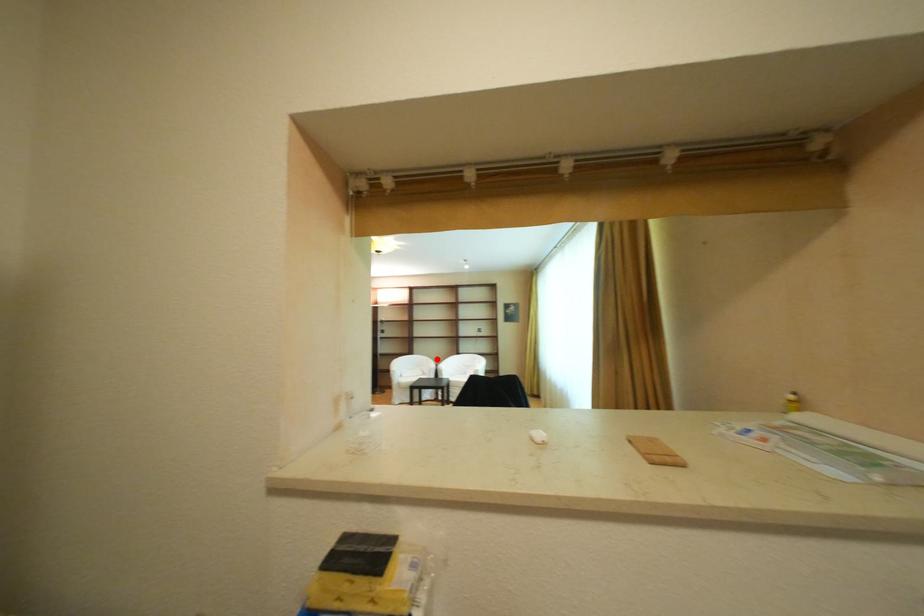
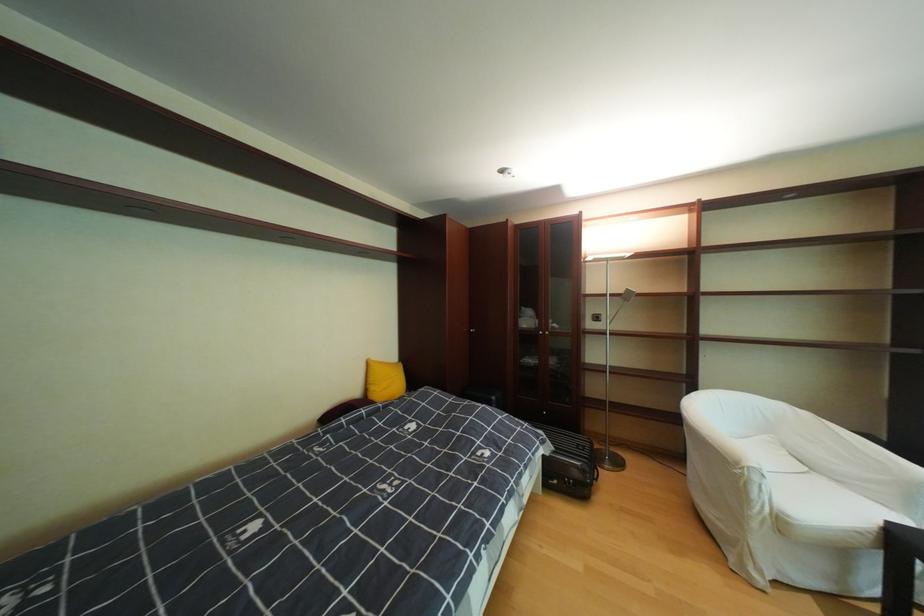
Question: I am providing you with two images of the same scene from different viewpoints. A red point is shown in image1. For the corresponding object point in image2, is it positioned nearer or farther from the camera?

Choices:
 (A) Nearer
 (B) Farther

Answer: (A)